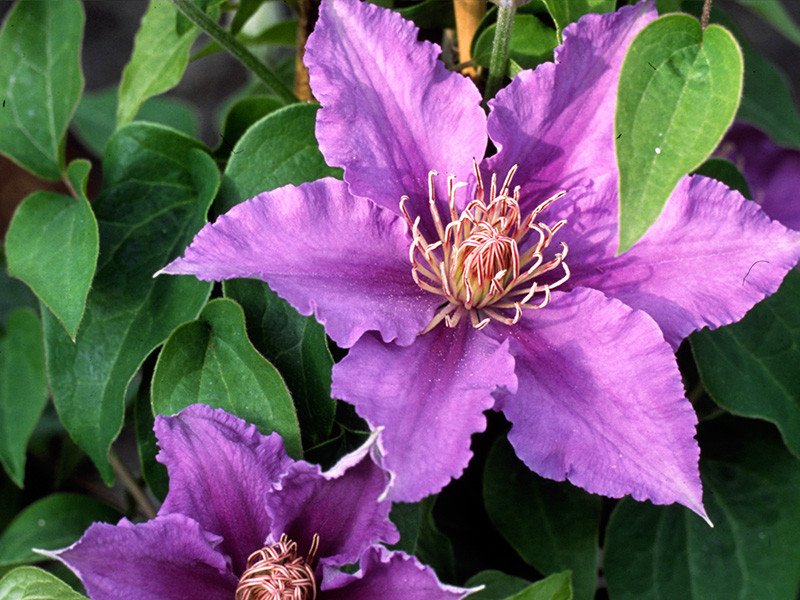
I want to click on left flower, so click(x=201, y=538).